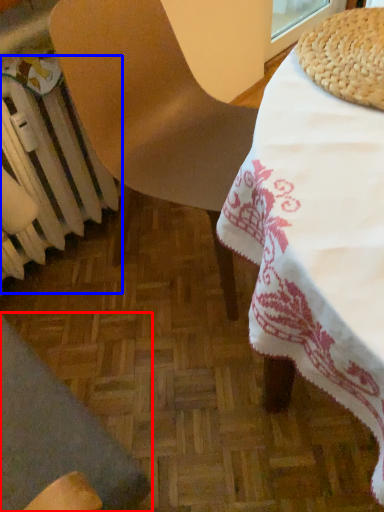
Question: Among these objects, which one is nearest to the camera, chair (highlighted by a red box) or radiator (highlighted by a blue box)?

Choices:
 (A) chair
 (B) radiator

Answer: (A)